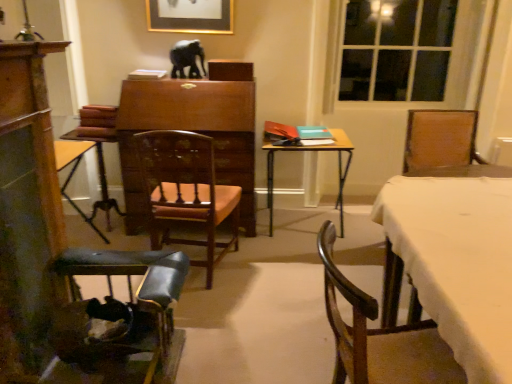
Where is `spots to the right of wooden polished chair at center, the 2th chair from the left`? spots to the right of wooden polished chair at center, the 2th chair from the left is located at coordinates (267, 274).